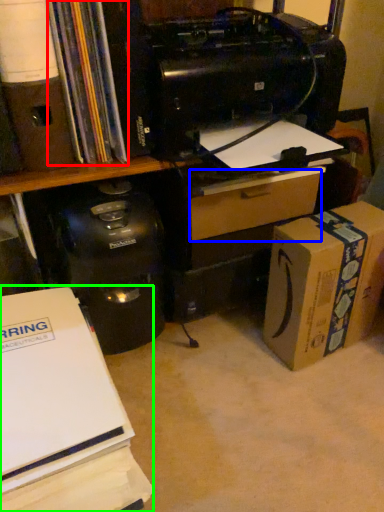
Question: Which is nearer to the book (highlighted by a red box)? drawer (highlighted by a blue box) or office supplies (highlighted by a green box).

Choices:
 (A) drawer
 (B) office supplies

Answer: (A)